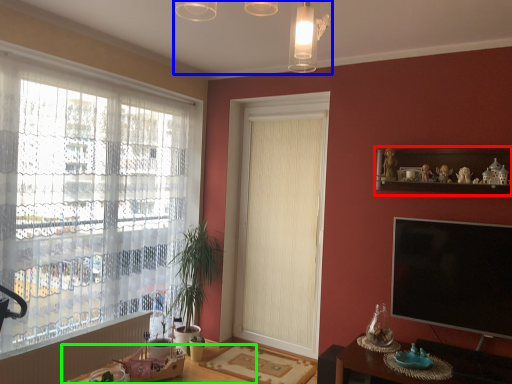
Question: Which is nearer to the shelf (highlighted by a red box)? light fixture (highlighted by a blue box) or round table (highlighted by a green box).

Choices:
 (A) light fixture
 (B) round table

Answer: (A)